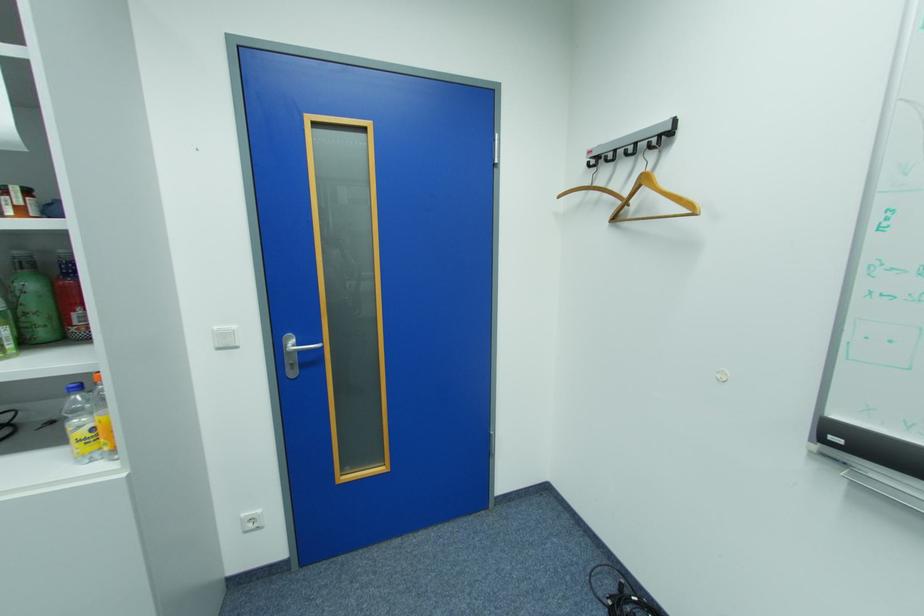
The image size is (924, 616). What do you see at coordinates (631, 143) in the screenshot? I see `the black coat hook` at bounding box center [631, 143].